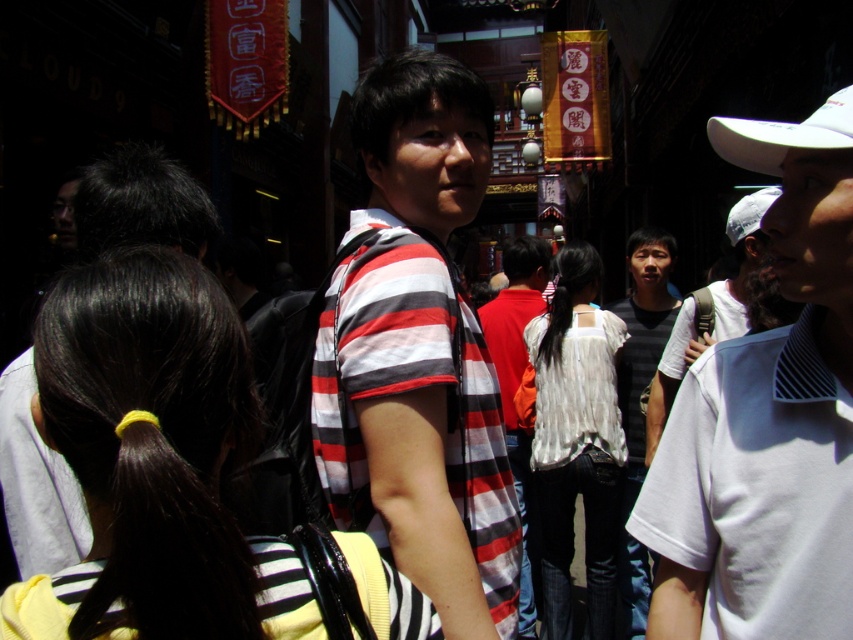
Between white cotton shirt at center and white matte baseball cap at upper right, which one has less height?

white matte baseball cap at upper right is shorter.

The width and height of the screenshot is (853, 640). Find the location of `white cotton shirt at center`. white cotton shirt at center is located at coordinates (767, 419).

Where is `white cotton shirt at center`? This screenshot has width=853, height=640. white cotton shirt at center is located at coordinates (767, 419).

Can you confirm if white cotton shirt at center is positioned to the left of dark gray striped shirt at center?

Indeed, white cotton shirt at center is positioned on the left side of dark gray striped shirt at center.

What are the coordinates of `white cotton shirt at center` in the screenshot? It's located at (767, 419).

Is striped cotton shirt at center positioned before red cotton shirt at center?

Yes.

Between striped cotton shirt at center and red cotton shirt at center, which one has less height?

Standing shorter between the two is red cotton shirt at center.

Does point (384, 504) come behind point (500, 349)?

No.

Locate an element on the screen. This screenshot has height=640, width=853. striped cotton shirt at center is located at coordinates (418, 355).